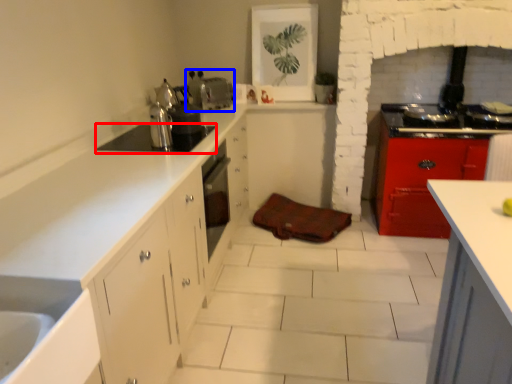
Question: Among these objects, which one is nearest to the camera, appliance (highlighted by a red box) or appliance (highlighted by a blue box)?

Choices:
 (A) appliance
 (B) appliance

Answer: (A)